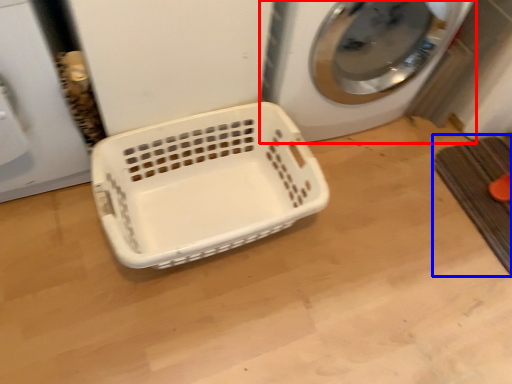
Question: Which of the following is the closest to the observer, washing machine (highlighted by a red box) or bath mat (highlighted by a blue box)?

Choices:
 (A) washing machine
 (B) bath mat

Answer: (A)